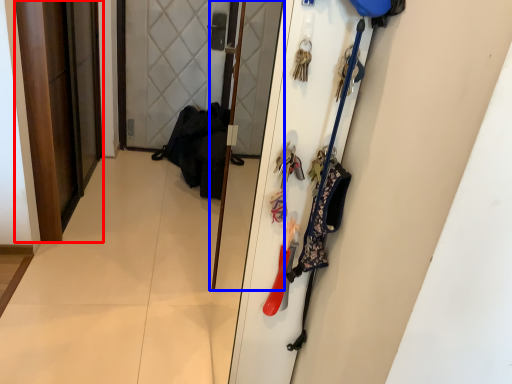
Question: Among these objects, which one is farthest to the camera, door (highlighted by a red box) or screen door (highlighted by a blue box)?

Choices:
 (A) door
 (B) screen door

Answer: (A)